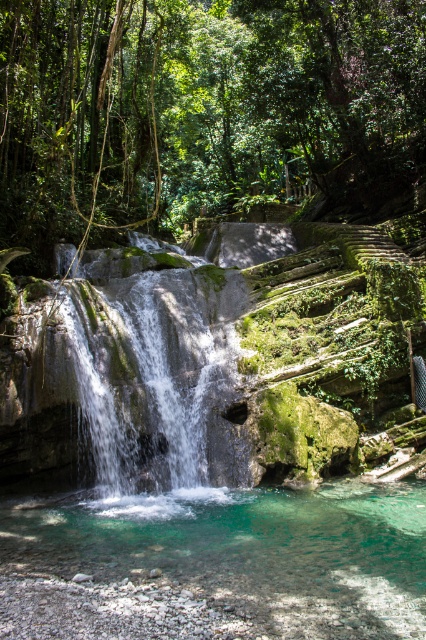
Is green mossy rocks at center further to camera compared to clear glass water at center?

Yes, it is.

Find the location of a particular element. The height and width of the screenshot is (640, 426). green mossy rocks at center is located at coordinates (206, 113).

Identify the location of clear glass water at center. Image resolution: width=426 pixels, height=640 pixels. (216, 564).

In the scene shown: Can you confirm if clear glass water at center is positioned above green mossy waterfall at center?

Indeed, clear glass water at center is positioned over green mossy waterfall at center.

Locate an element on the screen. The width and height of the screenshot is (426, 640). clear glass water at center is located at coordinates (216, 564).

Which is behind, point (71, 138) or point (94, 381)?

Positioned behind is point (71, 138).

Who is more forward, (x=108, y=168) or (x=203, y=392)?

Positioned in front is point (x=203, y=392).

The height and width of the screenshot is (640, 426). I want to click on green mossy rocks at center, so click(206, 113).